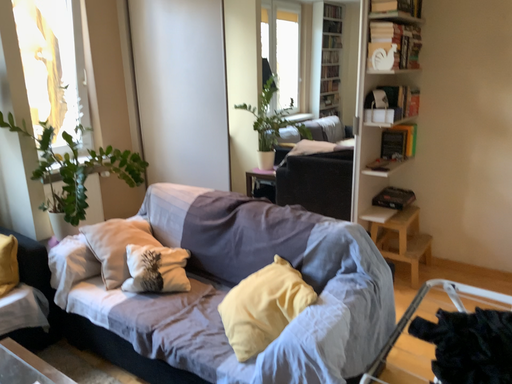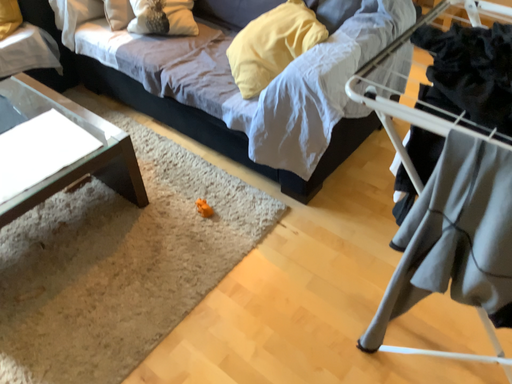
Question: How did the camera likely rotate when shooting the video?

Choices:
 (A) rotated downward
 (B) rotated upward

Answer: (A)